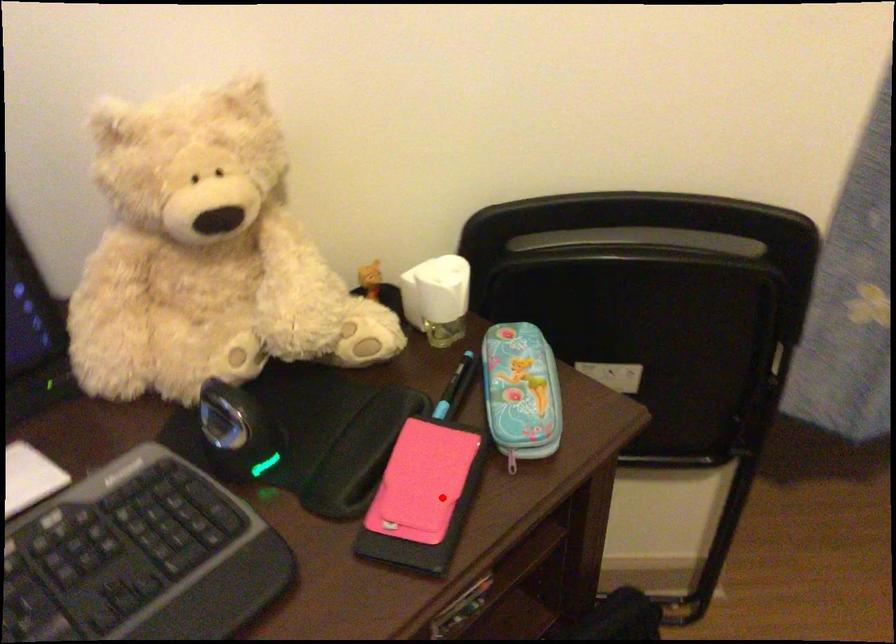
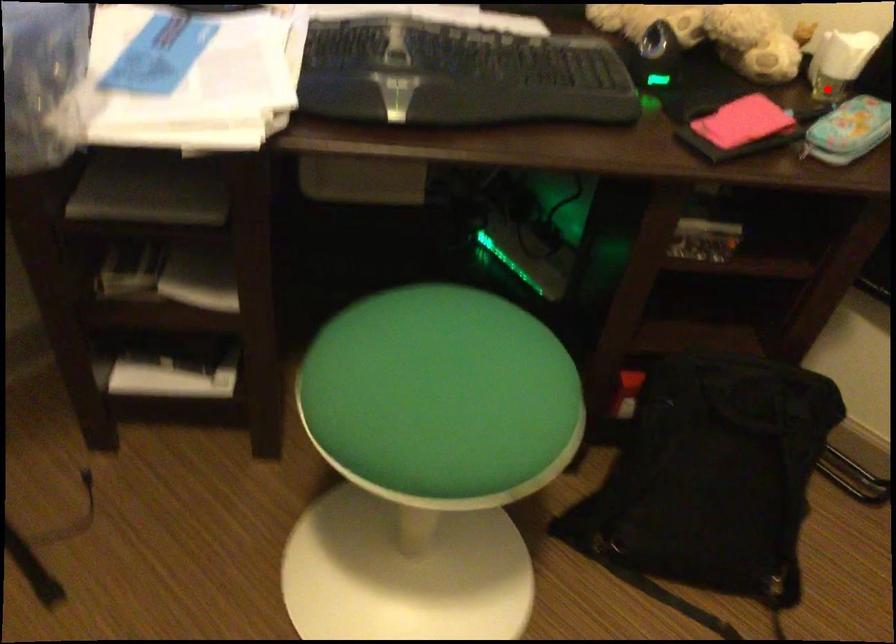
I am providing you with two images of the same scene from different viewpoints. A red point is marked on the first image and another point is marked on the second image. Does the point marked in image1 correspond to the same location as the one in image2?

No